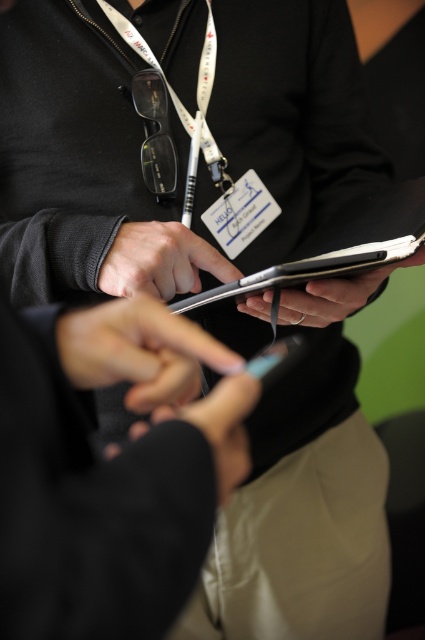
Is satin black phone at center to the left of smooth black glove at center from the viewer's perspective?

Indeed, satin black phone at center is positioned on the left side of smooth black glove at center.

Is satin black phone at center taller than smooth black glove at center?

Yes.

Who is more forward, (125, 308) or (227, 477)?

Point (227, 477)

At what (x,y) coordinates should I click in order to perform the action: click on satin black phone at center. Please return your answer as a coordinate pair (x, y). Looking at the image, I should click on (146, 356).

Is satin black phone at center closer to the viewer compared to matte black clipboard at center?

Yes, it is in front of matte black clipboard at center.

Is satin black phone at center positioned at the back of matte black clipboard at center?

No, satin black phone at center is closer to the viewer.

Locate an element on the screen. This screenshot has height=640, width=425. satin black phone at center is located at coordinates (146, 356).

Where is `satin black phone at center`? This screenshot has height=640, width=425. satin black phone at center is located at coordinates (146, 356).

Is the position of matte black clipboard at center less distant than that of matte black pen at center?

Yes.

Between point (402, 240) and point (184, 262), which one is positioned behind?

The point (184, 262) is more distant.

Find the location of a particular element. This screenshot has height=640, width=425. matte black clipboard at center is located at coordinates (340, 244).